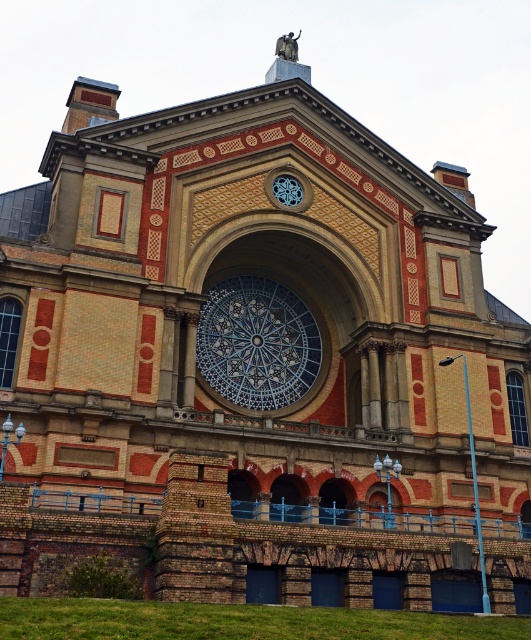
You are standing in front of Alexandra Palace and want to take a photo. You notice two points on the facade marked as point 1 at coordinates (205, 376) and point 2 at coordinates (282, 189). Which point will appear larger in your photo?

Point 1 at coordinates (205, 376) will appear larger in the photo because it is closer to the camera than point 2 at coordinates (282, 189).

You are an architect analyzing the facade of Alexandra Palace. You notice the blue stained glass window at center. Can you provide the exact coordinates where this window is located?

The blue stained glass window at center is located at point (256, 342).